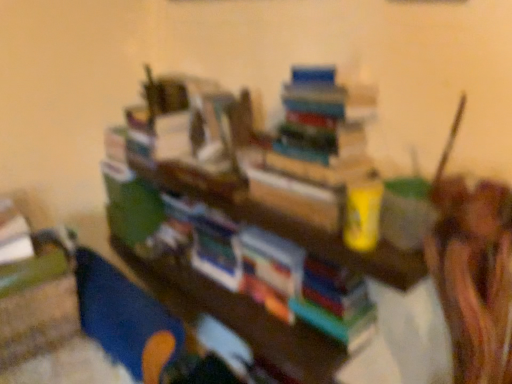
Question: Considering the relative sizes of hardcover books at upper center and blue plastic toy at lower left in the image provided, is hardcover books at upper center wider than blue plastic toy at lower left?

Choices:
 (A) yes
 (B) no

Answer: (B)

Question: From the image's perspective, would you say hardcover books at upper center is positioned over blue plastic toy at lower left?

Choices:
 (A) no
 (B) yes

Answer: (B)

Question: Is blue plastic toy at lower left surrounded by hardcover books at upper center?

Choices:
 (A) yes
 (B) no

Answer: (B)

Question: Is hardcover books at upper center positioned before blue plastic toy at lower left?

Choices:
 (A) no
 (B) yes

Answer: (B)

Question: Can you confirm if hardcover books at upper center is shorter than blue plastic toy at lower left?

Choices:
 (A) no
 (B) yes

Answer: (B)

Question: Is hardcover books at upper center directly adjacent to blue plastic toy at lower left?

Choices:
 (A) yes
 (B) no

Answer: (B)

Question: Does blue plastic toy at lower left lie behind hardcover books at upper center?

Choices:
 (A) no
 (B) yes

Answer: (B)

Question: Is blue plastic toy at lower left positioned with its back to hardcover books at upper center?

Choices:
 (A) yes
 (B) no

Answer: (B)

Question: From the image's perspective, is blue plastic toy at lower left over hardcover books at upper center?

Choices:
 (A) no
 (B) yes

Answer: (A)

Question: Considering the relative sizes of blue plastic toy at lower left and hardcover books at upper center in the image provided, is blue plastic toy at lower left thinner than hardcover books at upper center?

Choices:
 (A) yes
 (B) no

Answer: (B)

Question: Considering the relative sizes of blue plastic toy at lower left and hardcover books at upper center in the image provided, is blue plastic toy at lower left shorter than hardcover books at upper center?

Choices:
 (A) no
 (B) yes

Answer: (A)

Question: Can you confirm if blue plastic toy at lower left is taller than hardcover books at upper center?

Choices:
 (A) yes
 (B) no

Answer: (A)

Question: Would you say blue plastic toy at lower left is inside or outside hardcover books at upper center?

Choices:
 (A) outside
 (B) inside

Answer: (A)